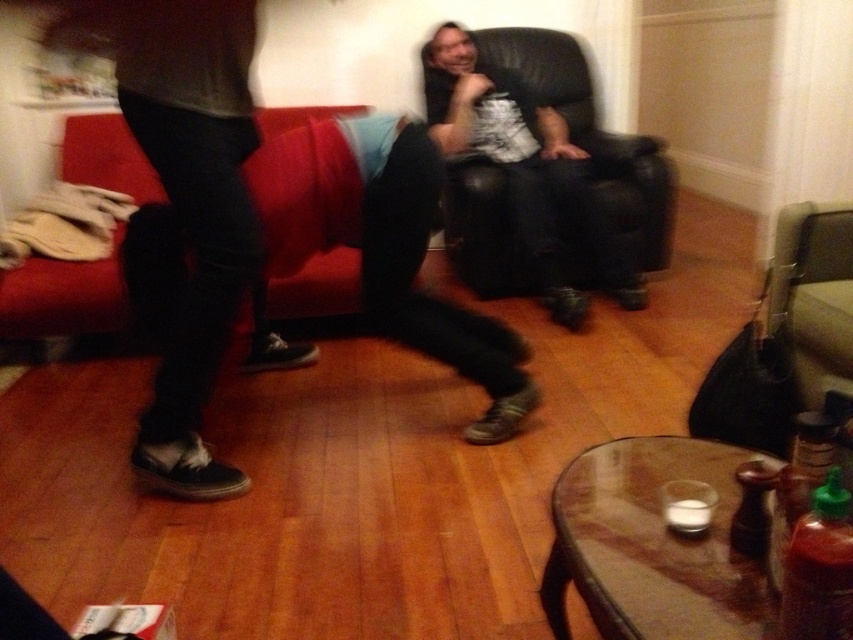
Question: Does matte black leather chair at center appear under red fabric couch at left?

Choices:
 (A) no
 (B) yes

Answer: (A)

Question: Among these objects, which one is nearest to the camera?

Choices:
 (A) red fabric couch at left
 (B) matte black leather chair at center

Answer: (A)

Question: Among these objects, which one is nearest to the camera?

Choices:
 (A) red fabric couch at left
 (B) matte black leather chair at center

Answer: (A)

Question: Can you confirm if matte black leather chair at center is positioned below red fabric couch at left?

Choices:
 (A) yes
 (B) no

Answer: (B)

Question: Observing the image, what is the correct spatial positioning of matte black leather chair at center in reference to red fabric couch at left?

Choices:
 (A) right
 (B) left

Answer: (A)